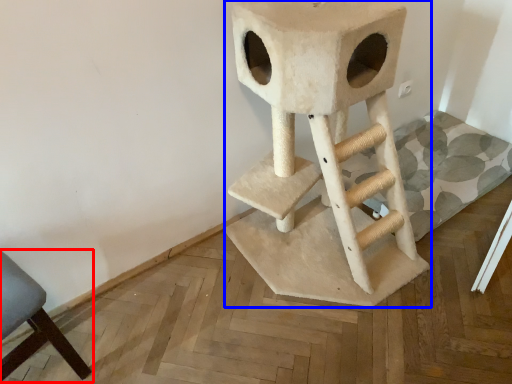
Question: Which of the following is the closest to the observer, chair (highlighted by a red box) or bar stool (highlighted by a blue box)?

Choices:
 (A) chair
 (B) bar stool

Answer: (B)